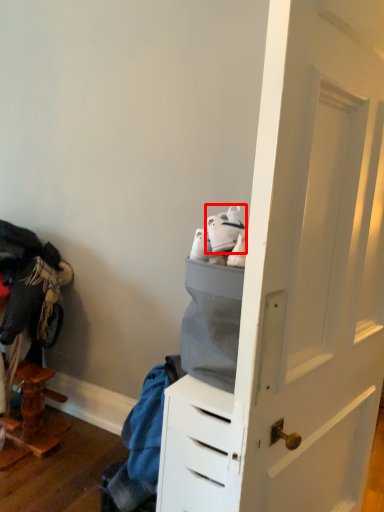
Question: From the image, what is the correct spatial relationship of footwear (annotated by the red box) in relation to clothing?

Choices:
 (A) left
 (B) right

Answer: (B)